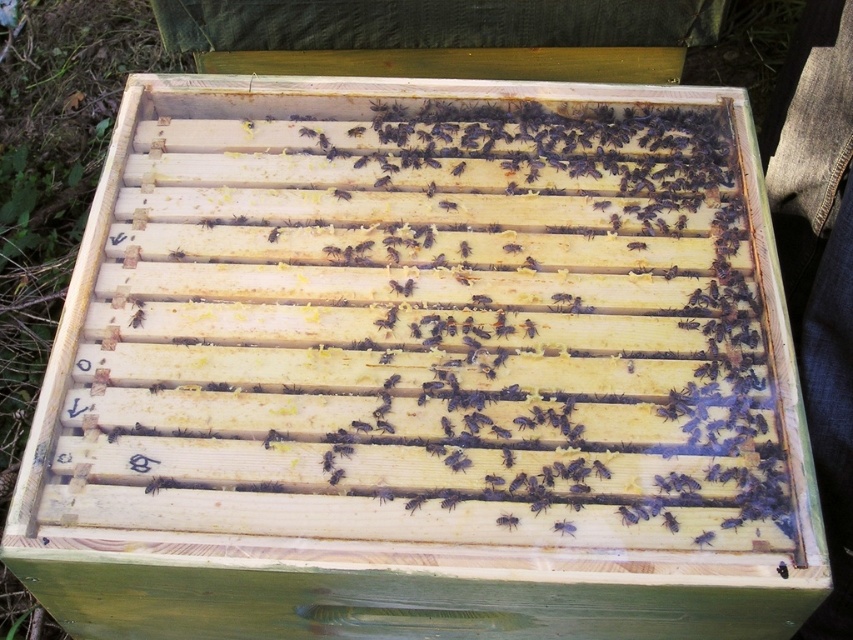
You are a beekeeper inspecting a beehive frame. You notice a black matte bee at center. Where exactly is the black matte bee located on the frame?

The black matte bee at center is located at coordinates point (508, 520) on the frame.